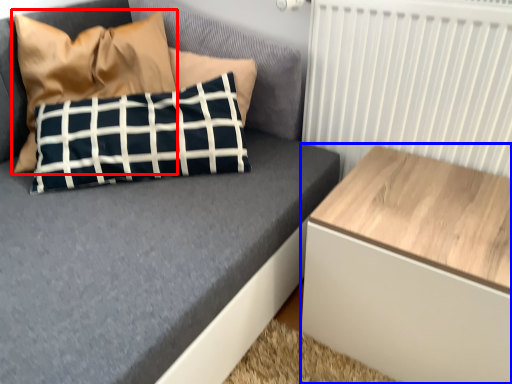
Question: Among these objects, which one is farthest to the camera, pillow (highlighted by a red box) or table (highlighted by a blue box)?

Choices:
 (A) pillow
 (B) table

Answer: (A)